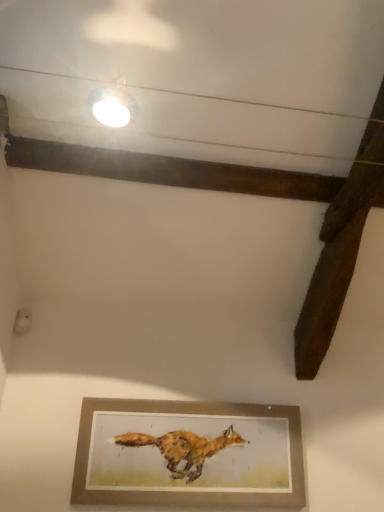
Question: Can you confirm if wooden picture frame at lower center is positioned to the left of white glossy light fixture at upper center?

Choices:
 (A) no
 (B) yes

Answer: (A)

Question: Considering the relative sizes of wooden picture frame at lower center and white glossy light fixture at upper center in the image provided, is wooden picture frame at lower center smaller than white glossy light fixture at upper center?

Choices:
 (A) no
 (B) yes

Answer: (A)

Question: From a real-world perspective, is wooden picture frame at lower center located higher than white glossy light fixture at upper center?

Choices:
 (A) yes
 (B) no

Answer: (B)

Question: Considering the relative sizes of wooden picture frame at lower center and white glossy light fixture at upper center in the image provided, is wooden picture frame at lower center taller than white glossy light fixture at upper center?

Choices:
 (A) yes
 (B) no

Answer: (A)

Question: Does wooden picture frame at lower center have a lesser height compared to white glossy light fixture at upper center?

Choices:
 (A) no
 (B) yes

Answer: (A)

Question: From the image's perspective, would you say wooden picture frame at lower center is shown under white glossy light fixture at upper center?

Choices:
 (A) yes
 (B) no

Answer: (A)

Question: Considering the relative sizes of white glossy light fixture at upper center and wooden picture frame at lower center in the image provided, is white glossy light fixture at upper center smaller than wooden picture frame at lower center?

Choices:
 (A) yes
 (B) no

Answer: (A)

Question: Is white glossy light fixture at upper center not within wooden picture frame at lower center?

Choices:
 (A) yes
 (B) no

Answer: (A)

Question: Is the depth of white glossy light fixture at upper center less than that of wooden picture frame at lower center?

Choices:
 (A) yes
 (B) no

Answer: (A)

Question: Considering the relative sizes of white glossy light fixture at upper center and wooden picture frame at lower center in the image provided, is white glossy light fixture at upper center thinner than wooden picture frame at lower center?

Choices:
 (A) no
 (B) yes

Answer: (A)

Question: Considering the relative sizes of white glossy light fixture at upper center and wooden picture frame at lower center in the image provided, is white glossy light fixture at upper center wider than wooden picture frame at lower center?

Choices:
 (A) no
 (B) yes

Answer: (B)

Question: From a real-world perspective, is white glossy light fixture at upper center physically below wooden picture frame at lower center?

Choices:
 (A) yes
 (B) no

Answer: (B)

Question: Is point (193, 408) positioned closer to the camera than point (107, 110)?

Choices:
 (A) closer
 (B) farther

Answer: (B)